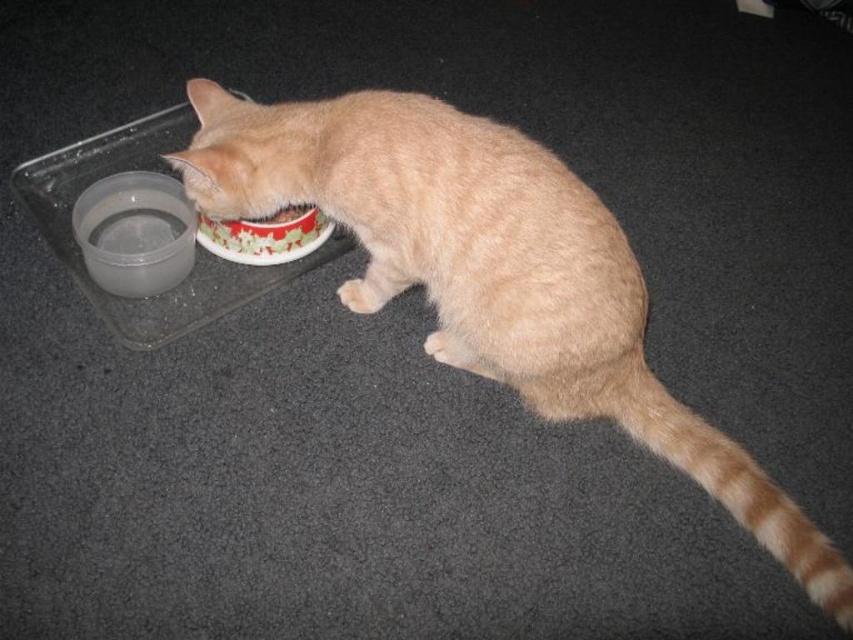
You are a pet sitter who needs to place a new feeding tray. The tray must accommodate both the light brown fur cat at center and the red glossy bowl at center. Based on their sizes, will the tray need to be larger than the current one?

The light brown fur cat at center is much taller than the red glossy bowl at center, so the tray must be larger than the current one to accommodate both the light brown fur cat at center and the red glossy bowl at center comfortably.

You are a pet sitter who needs to place a 6 inch long toy between the transparent plastic bowl at lower left and the red glossy bowl at center. Is there enough space between them to fit the toy?

The transparent plastic bowl at lower left and the red glossy bowl at center are 5.55 inches apart. Since the toy is 6 inches long, it won not fit between them as the distance is shorter than the toy.

You are a pet sitter who needs to ensure the cat has enough space to move around its bowl. Based on the scene, can the light brown fur cat at center comfortably move around the transparent plastic bowl at lower left?

The light brown fur cat at center is wider than the transparent plastic bowl at lower left, so it should have enough space to move around the bowl comfortably.